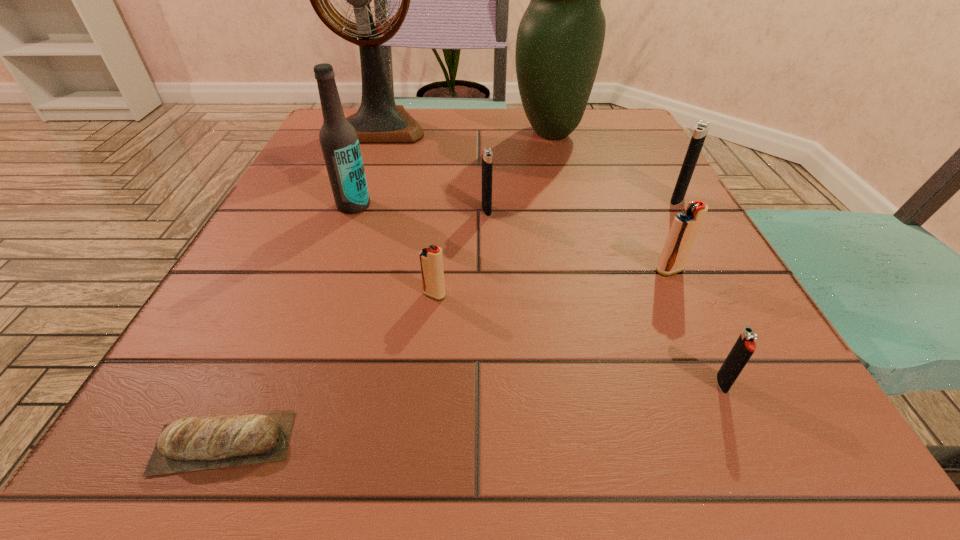
You are a GUI agent. You are given a task and a screenshot of the screen. Output one action in this format:
    pyautogui.click(x=<x>, y=<y>)
    Task: Click on the empty location between the tallest object and the sixth farthest object
    Image resolution: width=960 pixels, height=540 pixels.
    Given the screenshot: What is the action you would take?
    pyautogui.click(x=525, y=198)

Locate which object ranks sixth in proximity to the fourth object from right to left. Please provide its 2D coordinates. Your answer should be formatted as a tuple, i.e. [(x, y)], where the tuple contains the x and y coordinates of a point satisfying the conditions above.

[(431, 260)]

You are a GUI agent. You are given a task and a screenshot of the screen. Output one action in this format:
    pyautogui.click(x=<x>, y=<y>)
    Task: Click on the object identified as the fourth closest to the fifth object from right to left
    This screenshot has width=960, height=540.
    Given the screenshot: What is the action you would take?
    pyautogui.click(x=378, y=120)

Identify the location of igniter that is the closest one to the tallest object. [x=487, y=155].

The image size is (960, 540). Identify the location of igniter that is the second closest one to the tallest igniter. (487, 155).

Find the location of a particular element. black igniter that stands as the second closest to the brown fan is located at coordinates (701, 129).

The width and height of the screenshot is (960, 540). In order to click on the closest black igniter to the sixth shortest object in this screenshot , I will do `click(487, 155)`.

The image size is (960, 540). Find the location of `vacant space that satisfies the following two spatial constraints: 1. on the front-facing side of the fan; 2. on the left side of the fifth object from right to left`. vacant space that satisfies the following two spatial constraints: 1. on the front-facing side of the fan; 2. on the left side of the fifth object from right to left is located at coordinates (348, 210).

I want to click on vacant space that satisfies the following two spatial constraints: 1. on the label of the nearest igniter; 2. on the left side of the third tallest object, so click(x=288, y=383).